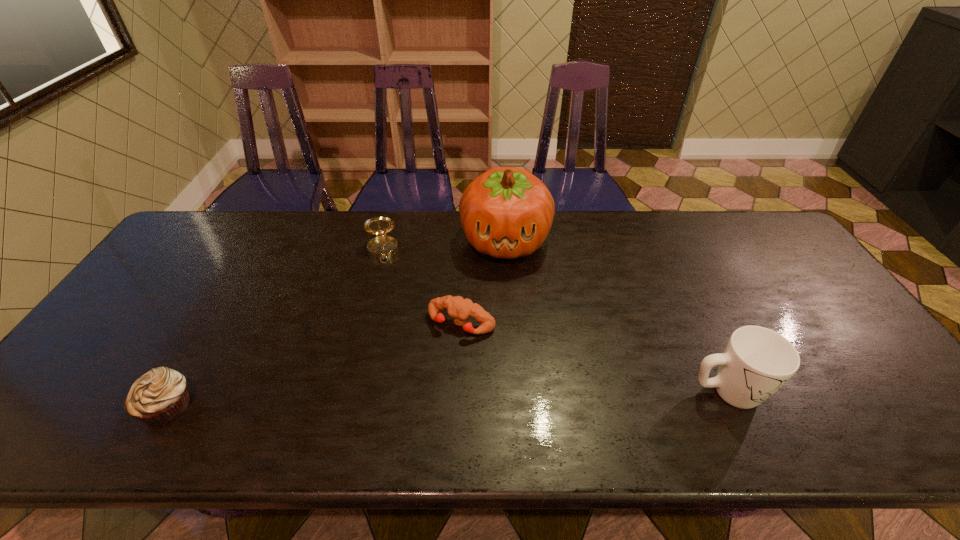
Where is `object that can be found as the second closest to the mug`? The width and height of the screenshot is (960, 540). object that can be found as the second closest to the mug is located at coordinates (460, 309).

This screenshot has height=540, width=960. Find the location of `object that is the closest to the pumpkin`. object that is the closest to the pumpkin is located at coordinates (460, 309).